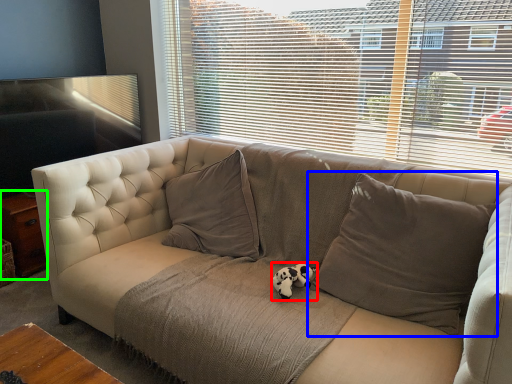
Question: Which is nearer to the animal (highlighted by a red box)? pillow (highlighted by a blue box) or table (highlighted by a green box).

Choices:
 (A) pillow
 (B) table

Answer: (A)